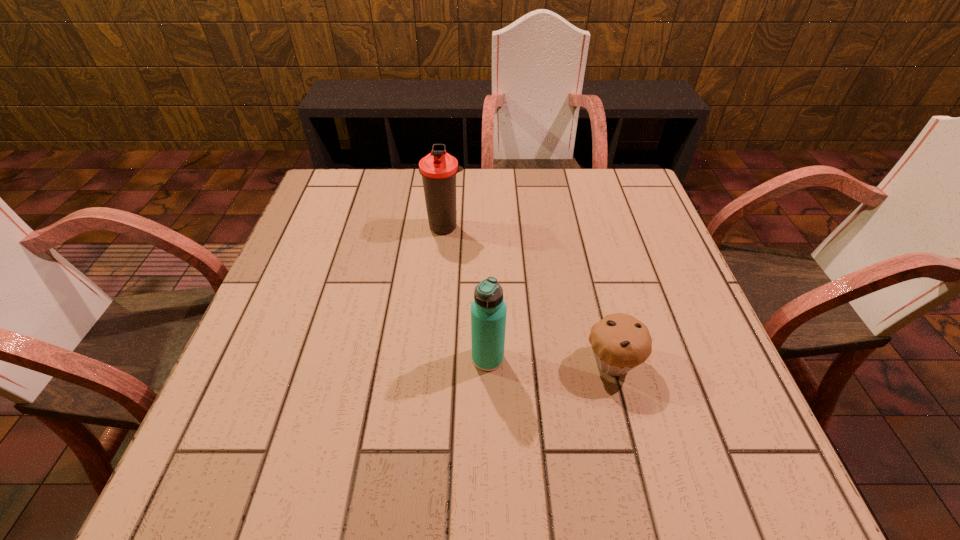
This screenshot has width=960, height=540. Identify the location of free area in between the muffin and the leftmost object. (529, 294).

Image resolution: width=960 pixels, height=540 pixels. In order to click on vacant area that lies between the rightmost object and the nearer thermos bottle in this screenshot , I will do `click(550, 360)`.

The width and height of the screenshot is (960, 540). Identify the location of free space that is in between the muffin and the leftmost object. (529, 294).

Where is `vacant area that lies between the nearer thermos bottle and the rightmost object`? Image resolution: width=960 pixels, height=540 pixels. vacant area that lies between the nearer thermos bottle and the rightmost object is located at coordinates (550, 360).

The image size is (960, 540). I want to click on vacant area between the left thermos bottle and the nearer thermos bottle, so click(467, 292).

Locate an element on the screen. This screenshot has width=960, height=540. empty space that is in between the leftmost object and the nearer thermos bottle is located at coordinates (467, 292).

I want to click on free space between the leftmost object and the rightmost object, so click(x=529, y=294).

Locate an element on the screen. object that is the second closest to the rightmost object is located at coordinates (438, 169).

Identify which object is the second nearest to the right thermos bottle. Please provide its 2D coordinates. Your answer should be formatted as a tuple, i.e. [(x, y)], where the tuple contains the x and y coordinates of a point satisfying the conditions above.

[(438, 169)]

At what (x,y) coordinates should I click in order to perform the action: click on free point that satisfies the following two spatial constraints: 1. on the front side of the muffin; 2. on the left side of the second object from left to right. Please return your answer as a coordinate pair (x, y). Looking at the image, I should click on (488, 362).